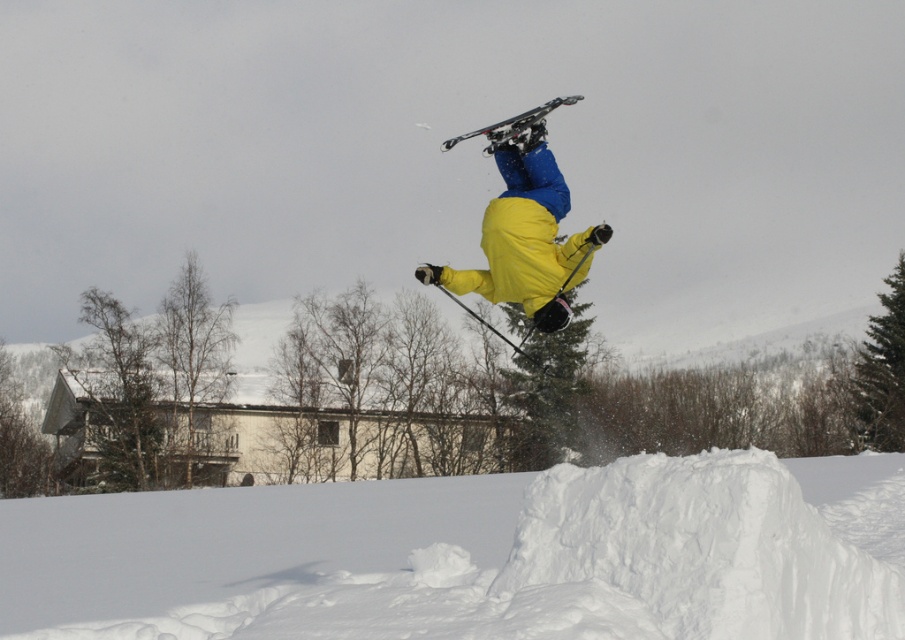
You are a photographer trying to capture the skier midair. You notice two points in the image labeled as point 1 at coordinates point (498,612) and point 2 at coordinates point (512,252). Which point is closer to the camera?

Point (498,612) is in front of point (512,252), so it is closer to the camera.

Based on the scene description, where is the white fluffy snow at center located in the image?

The white fluffy snow at center is located at point coordinates of (475, 556).